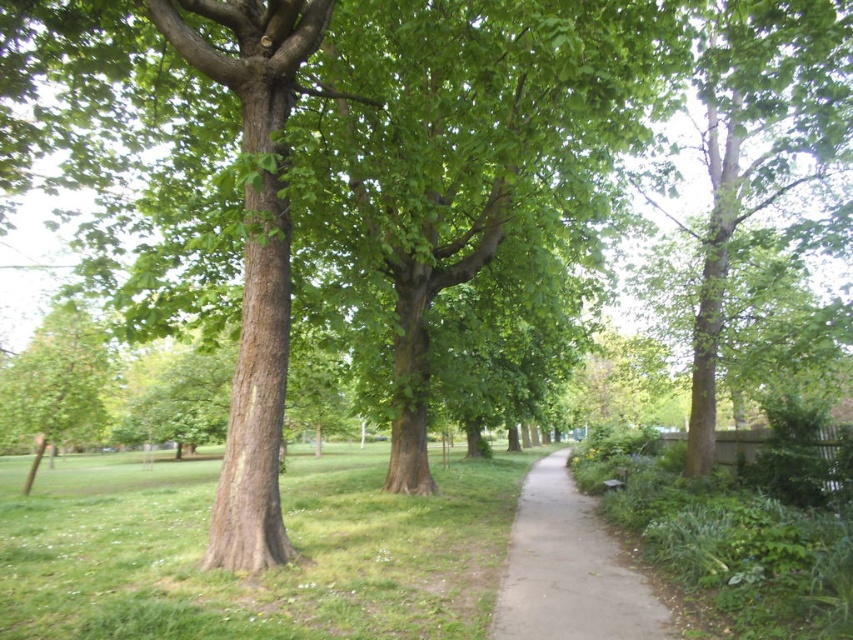
Question: Which is farther from the gray concrete path at center?

Choices:
 (A) green leafy tree at left
 (B) green leafy tree at right

Answer: (A)

Question: Is green grass at center to the left of green leafy tree at left from the viewer's perspective?

Choices:
 (A) no
 (B) yes

Answer: (A)

Question: Can you confirm if green leafy tree at right is positioned above green leafy tree at left?

Choices:
 (A) yes
 (B) no

Answer: (A)

Question: Which of the following is the farthest from the observer?

Choices:
 (A) (816, 122)
 (B) (622, 570)

Answer: (A)

Question: Does green leafy tree at right come in front of green leafy tree at left?

Choices:
 (A) yes
 (B) no

Answer: (A)

Question: Which of these objects is positioned closest to the gray concrete path at center?

Choices:
 (A) green leafy tree at left
 (B) green grass at center

Answer: (B)